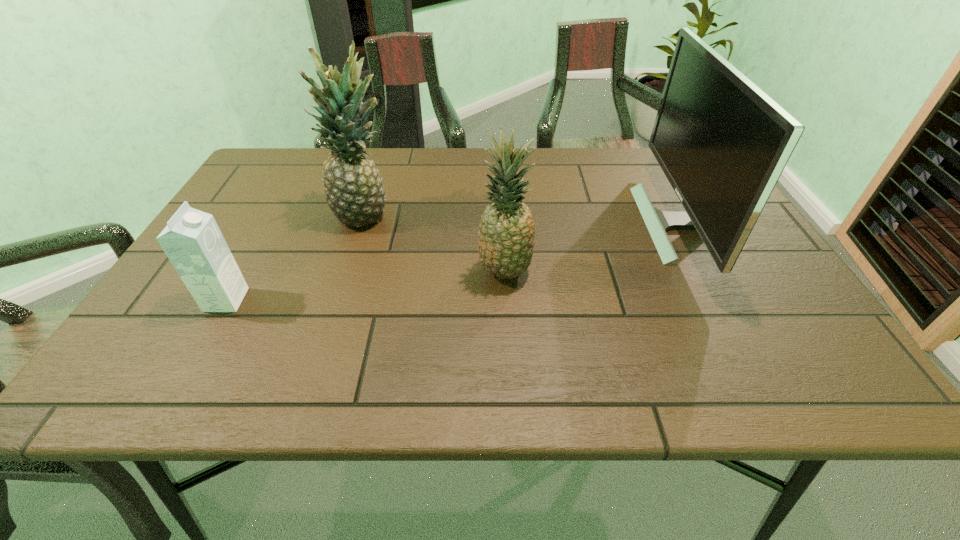
Where is `the second object from left to right`? the second object from left to right is located at coordinates (353, 188).

Where is `the farther pineapple`? Image resolution: width=960 pixels, height=540 pixels. the farther pineapple is located at coordinates (353, 188).

This screenshot has width=960, height=540. In order to click on monitor in this screenshot , I will do `click(723, 143)`.

The height and width of the screenshot is (540, 960). Identify the location of the shorter pineapple. (506, 241).

Image resolution: width=960 pixels, height=540 pixels. Identify the location of the second shortest object. (506, 241).

Find the location of a particular element. The width and height of the screenshot is (960, 540). the leftmost object is located at coordinates (192, 240).

Identify the location of carton. (192, 240).

At what (x,y) coordinates should I click in order to perform the action: click on free location located 0.110m on the right of the taller pineapple. Please return your answer as a coordinate pair (x, y). Looking at the image, I should click on pyautogui.click(x=438, y=215).

Where is `vacant region located 0.130m on the screen side of the monitor`? Image resolution: width=960 pixels, height=540 pixels. vacant region located 0.130m on the screen side of the monitor is located at coordinates (592, 224).

Locate an element on the screen. This screenshot has width=960, height=540. free space located on the screen side of the monitor is located at coordinates (621, 224).